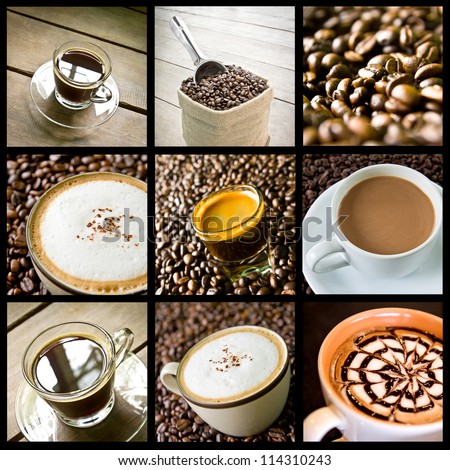
Identify the location of cups with handles and a scoop with a handle all handle related. (125, 360), (164, 377), (327, 430), (324, 255), (103, 89), (183, 33).